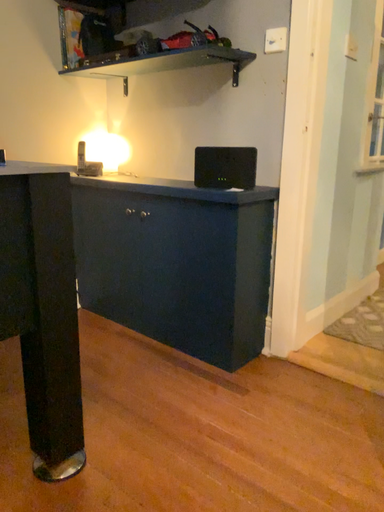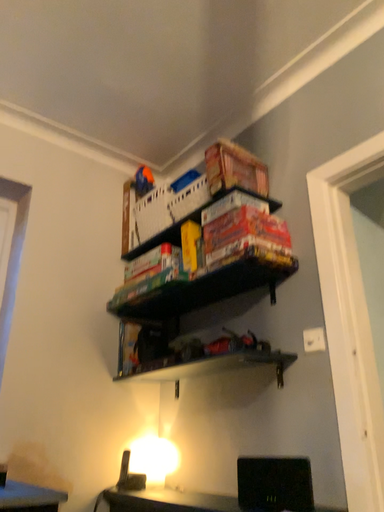
Question: How did the camera likely rotate when shooting the video?

Choices:
 (A) rotated upward
 (B) rotated downward

Answer: (A)